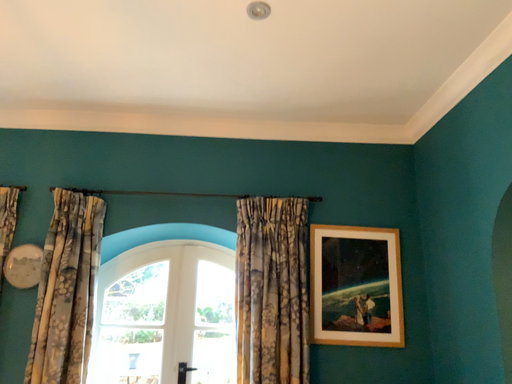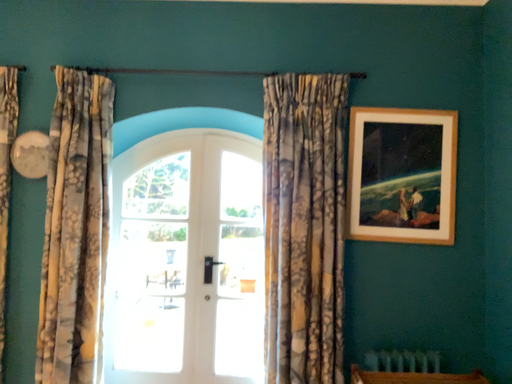
Question: Which way did the camera rotate in the video?

Choices:
 (A) rotated upward
 (B) rotated downward

Answer: (B)